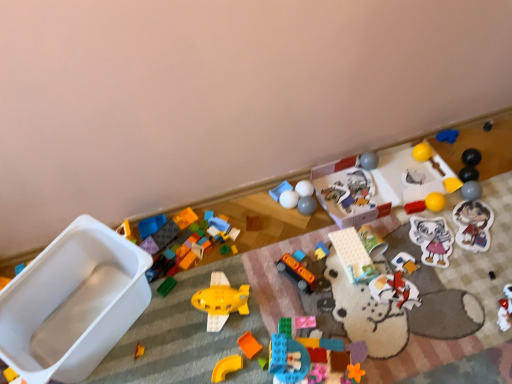
The width and height of the screenshot is (512, 384). I want to click on empty space that is in between orange matte bus at center, the tenth toy when ordered from left to right, and pink matte block at center, the twelfth toy viewed from the left, so tap(298, 302).